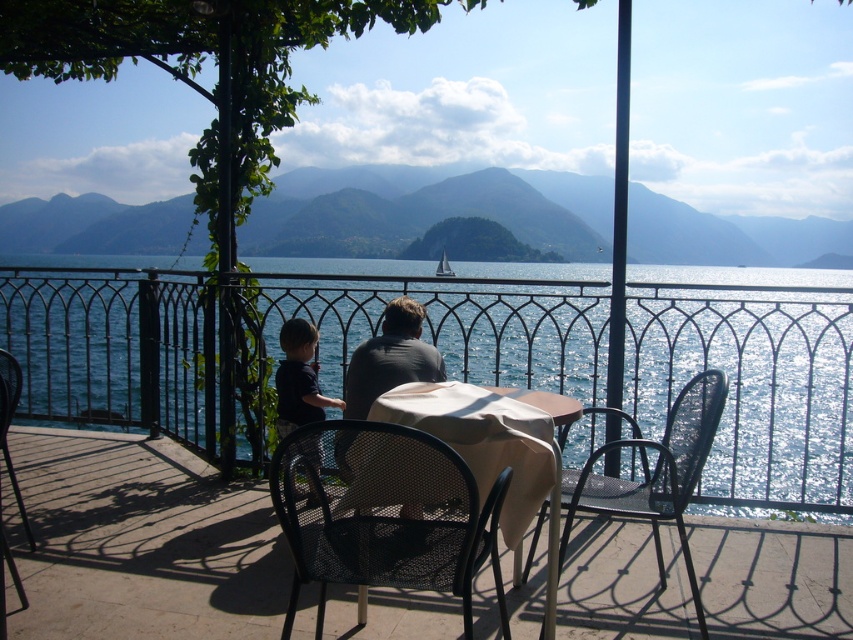
You are standing on the balcony and want to sit down to enjoy the view. Which object, the black metal chair at right or the dark blue shirt at lower left, is nearer to you so you can reach it without moving further away?

The black metal chair at right is closer to the viewer than the dark blue shirt at lower left, so you can reach it without moving further away.

You are standing at the center of the balcony and want to sit down. Which direction should you move to reach the black metal chair at right?

The black metal chair at right is located at point (654, 474), so you should move to the right and slightly forward to reach it.